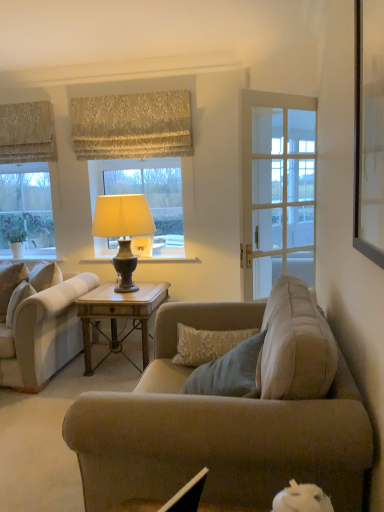
What do you see at coordinates (44, 334) in the screenshot? I see `light beige fabric couch at left` at bounding box center [44, 334].

Image resolution: width=384 pixels, height=512 pixels. What do you see at coordinates (123, 230) in the screenshot?
I see `matte cream lampshade at center` at bounding box center [123, 230].

Identify the location of white glass window at center, placed as the first window when sorted from right to left. The height and width of the screenshot is (512, 384). (146, 194).

The image size is (384, 512). I want to click on clear glass window at left, arranged as the 2th window when viewed from the right, so click(x=27, y=177).

I want to click on wooden table at center, so click(119, 315).

Considering the positions of objects white glass window at center, which appears as the second window when viewed from the left, and beige textured curtain at upper left, positioned as the 1th curtain in left-to-right order, in the image provided, who is behind, white glass window at center, which appears as the second window when viewed from the left, or beige textured curtain at upper left, positioned as the 1th curtain in left-to-right order,?

Positioned behind is white glass window at center, which appears as the second window when viewed from the left.

Would you say white glass window at center, placed as the first window when sorted from right to left, is a long distance from beige textured curtain at upper left, positioned as the 1th curtain in left-to-right order?

No, there isn't a large distance between white glass window at center, placed as the first window when sorted from right to left, and beige textured curtain at upper left, positioned as the 1th curtain in left-to-right order.

Considering the relative positions of white glass window at center, which appears as the second window when viewed from the left, and beige textured curtain at upper left, which is counted as the second curtain, starting from the right, in the image provided, is white glass window at center, which appears as the second window when viewed from the left, to the right of beige textured curtain at upper left, which is counted as the second curtain, starting from the right, from the viewer's perspective?

Yes, white glass window at center, which appears as the second window when viewed from the left, is to the right of beige textured curtain at upper left, which is counted as the second curtain, starting from the right.

Could you tell me if white glass window at center, placed as the first window when sorted from right to left, is facing beige textured curtain at upper left, positioned as the 1th curtain in left-to-right order?

No, white glass window at center, placed as the first window when sorted from right to left, is not aimed at beige textured curtain at upper left, positioned as the 1th curtain in left-to-right order.

Can you tell me how much matte cream lampshade at center and beige textured curtain at upper left, positioned as the 1th curtain in left-to-right order, differ in facing direction?

There is a 0.548-degree angle between the facing directions of matte cream lampshade at center and beige textured curtain at upper left, positioned as the 1th curtain in left-to-right order.

Is matte cream lampshade at center smaller than beige textured curtain at upper left, which is counted as the second curtain, starting from the right?

Actually, matte cream lampshade at center might be larger than beige textured curtain at upper left, which is counted as the second curtain, starting from the right.

Can you confirm if matte cream lampshade at center is positioned to the left of beige textured curtain at upper left, which is counted as the second curtain, starting from the right?

No.

Which is in front, point (99, 219) or point (41, 145)?

Positioned in front is point (99, 219).

How many degrees apart are the facing directions of gold textured fabric at upper center, arranged as the second curtain when viewed from the left, and matte cream lampshade at center?

The angle between the facing direction of gold textured fabric at upper center, arranged as the second curtain when viewed from the left, and the facing direction of matte cream lampshade at center is 0.548 degrees.

Could you measure the distance between gold textured fabric at upper center, arranged as the second curtain when viewed from the left, and matte cream lampshade at center?

gold textured fabric at upper center, arranged as the second curtain when viewed from the left, and matte cream lampshade at center are 31.11 inches apart from each other.

From the image's perspective, between gold textured fabric at upper center, the 1th curtain viewed from the right, and matte cream lampshade at center, which one is located above?

gold textured fabric at upper center, the 1th curtain viewed from the right, is shown above in the image.

Find the location of a particular element. the 1st curtain to the left of the matte cream lampshade at center, counting from the anchor's position is located at coordinates (132, 126).

How far apart are gold textured fabric at upper center, the 1th curtain viewed from the right, and wooden table at center?

gold textured fabric at upper center, the 1th curtain viewed from the right, is 4.57 feet from wooden table at center.

Which of these two, gold textured fabric at upper center, the 1th curtain viewed from the right, or wooden table at center, stands shorter?

With less height is gold textured fabric at upper center, the 1th curtain viewed from the right.

Considering the sizes of objects gold textured fabric at upper center, arranged as the second curtain when viewed from the left, and wooden table at center in the image provided, who is wider, gold textured fabric at upper center, arranged as the second curtain when viewed from the left, or wooden table at center?

Wider between the two is wooden table at center.

Considering the positions of objects gold textured fabric at upper center, the 1th curtain viewed from the right, and wooden table at center in the image provided, who is more to the left, gold textured fabric at upper center, the 1th curtain viewed from the right, or wooden table at center?

gold textured fabric at upper center, the 1th curtain viewed from the right.

Can you confirm if wooden table at center is wider than clear glass window at left, arranged as the 2th window when viewed from the right?

Yes, wooden table at center is wider than clear glass window at left, arranged as the 2th window when viewed from the right.

Is wooden table at center positioned in front of clear glass window at left, arranged as the 2th window when viewed from the right?

Yes.

Between wooden table at center and clear glass window at left, arranged as the 2th window when viewed from the right, which one has less height?

wooden table at center is shorter.

Starting from the wooden table at center, which window is the 2nd one behind? Please provide its 2D coordinates.

[(27, 177)]

How many degrees apart are the facing directions of light beige fabric couch at left and wooden table at center?

There is a 1.97-degree angle between the facing directions of light beige fabric couch at left and wooden table at center.

Is light beige fabric couch at left facing away from wooden table at center?

That's not correct — light beige fabric couch at left is not looking away from wooden table at center.

Relative to wooden table at center, is light beige fabric couch at left in front or behind?

Visually, light beige fabric couch at left is located in front of wooden table at center.

I want to click on desk below the light beige fabric couch at left (from a real-world perspective), so click(x=119, y=315).

Is gold textured fabric at upper center, arranged as the second curtain when viewed from the left, placed right next to clear glass window at left, arranged as the 2th window when viewed from the right?

There is a gap between gold textured fabric at upper center, arranged as the second curtain when viewed from the left, and clear glass window at left, arranged as the 2th window when viewed from the right.

In the image, is gold textured fabric at upper center, arranged as the second curtain when viewed from the left, positioned in front of or behind clear glass window at left, which ranks as the 1th window in left-to-right order?

Visually, gold textured fabric at upper center, arranged as the second curtain when viewed from the left, is located in front of clear glass window at left, which ranks as the 1th window in left-to-right order.

Would you say gold textured fabric at upper center, the 1th curtain viewed from the right, is outside clear glass window at left, which ranks as the 1th window in left-to-right order?

Yes, gold textured fabric at upper center, the 1th curtain viewed from the right, is located beyond the bounds of clear glass window at left, which ranks as the 1th window in left-to-right order.

From the image's perspective, count 1st curtains upward from the white glass window at center, placed as the first window when sorted from right to left, and point to it. Please provide its 2D coordinates.

[(27, 132)]

From a real-world perspective, count 1st curtains upward from the matte cream lampshade at center and point to it. Please provide its 2D coordinates.

[(27, 132)]

Based on their spatial positions, is white glass window at center, placed as the first window when sorted from right to left, or light beige fabric couch at left closer to wooden table at center?

light beige fabric couch at left is positioned closer to the anchor wooden table at center.

Based on their spatial positions, is clear glass window at left, arranged as the 2th window when viewed from the right, or gold textured fabric at upper center, arranged as the second curtain when viewed from the left, closer to wooden picture frame at upper right?

Based on the image, gold textured fabric at upper center, arranged as the second curtain when viewed from the left, appears to be nearer to wooden picture frame at upper right.

Looking at the image, which one is located closer to light beige fabric couch at left, beige textured curtain at upper left, positioned as the 1th curtain in left-to-right order, or white glass window at center, which appears as the second window when viewed from the left?

white glass window at center, which appears as the second window when viewed from the left, is positioned closer to the anchor light beige fabric couch at left.

When comparing their distances from beige textured curtain at upper left, positioned as the 1th curtain in left-to-right order, does clear glass window at left, which ranks as the 1th window in left-to-right order, or light beige fabric couch at left seem closer?

clear glass window at left, which ranks as the 1th window in left-to-right order.

Considering their positions, is clear glass window at left, arranged as the 2th window when viewed from the right, positioned closer to gold textured fabric at upper center, the 1th curtain viewed from the right, than matte cream lampshade at center?

Among the two, clear glass window at left, arranged as the 2th window when viewed from the right, is located nearer to gold textured fabric at upper center, the 1th curtain viewed from the right.

Looking at the image, which one is located closer to wooden table at center, gold textured fabric at upper center, arranged as the second curtain when viewed from the left, or beige textured curtain at upper left, positioned as the 1th curtain in left-to-right order?

Based on the image, gold textured fabric at upper center, arranged as the second curtain when viewed from the left, appears to be nearer to wooden table at center.

When comparing their distances from white glass window at center, placed as the first window when sorted from right to left, does clear glass window at left, which ranks as the 1th window in left-to-right order, or matte cream lampshade at center seem further?

clear glass window at left, which ranks as the 1th window in left-to-right order.

Based on their spatial positions, is gold textured fabric at upper center, the 1th curtain viewed from the right, or white glass window at center, which appears as the second window when viewed from the left, further from wooden picture frame at upper right?

white glass window at center, which appears as the second window when viewed from the left.

The height and width of the screenshot is (512, 384). I want to click on studio couch between wooden picture frame at upper right and gold textured fabric at upper center, arranged as the second curtain when viewed from the left, in the front-back direction, so click(44, 334).

I want to click on lamp between beige textured curtain at upper left, which is counted as the second curtain, starting from the right, and white glass window at center, which appears as the second window when viewed from the left, so tap(123, 230).

This screenshot has width=384, height=512. Identify the location of curtain between gold textured fabric at upper center, arranged as the second curtain when viewed from the left, and matte cream lampshade at center in the up-down direction. (27, 132).

The width and height of the screenshot is (384, 512). Identify the location of window between light beige fabric couch at left and clear glass window at left, which ranks as the 1th window in left-to-right order, along the z-axis. (146, 194).